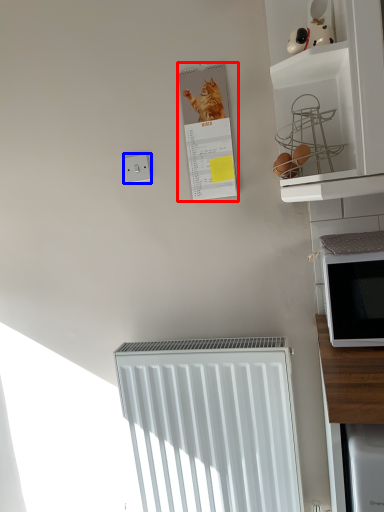
Question: Which point is closer to the camera, bulletin board (highlighted by a red box) or electric outlet (highlighted by a blue box)?

Choices:
 (A) bulletin board
 (B) electric outlet

Answer: (A)